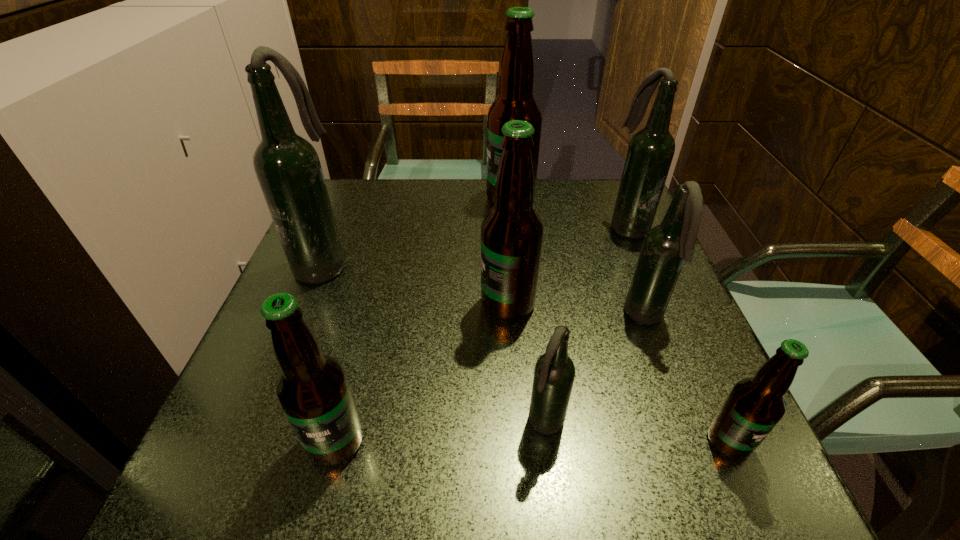
This screenshot has height=540, width=960. Identify the location of the farthest object. (515, 101).

The height and width of the screenshot is (540, 960). In order to click on the farthest beer bottle in this screenshot , I will do `click(515, 101)`.

The height and width of the screenshot is (540, 960). Identify the location of the biggest dark beer bottle. (287, 166).

You are a GUI agent. You are given a task and a screenshot of the screen. Output one action in this format:
    pyautogui.click(x=<x>, y=<y>)
    Task: Click on the leftmost object
    
    Given the screenshot: What is the action you would take?
    pyautogui.click(x=287, y=166)

Locate an element on the screen. This screenshot has height=540, width=960. the farthest dark beer bottle is located at coordinates (651, 150).

The image size is (960, 540). In order to click on the second farthest beer bottle in this screenshot , I will do `click(651, 150)`.

The height and width of the screenshot is (540, 960). Identify the location of the second farthest brown beer bottle. (511, 232).

Locate an element on the screen. This screenshot has height=540, width=960. the third biggest dark beer bottle is located at coordinates (666, 247).

Where is `the leftmost brown beer bottle`? This screenshot has width=960, height=540. the leftmost brown beer bottle is located at coordinates (312, 389).

At what (x,y) coordinates should I click in order to perform the action: click on the third biggest brown beer bottle. Please return your answer as a coordinate pair (x, y). This screenshot has height=540, width=960. Looking at the image, I should click on point(312,389).